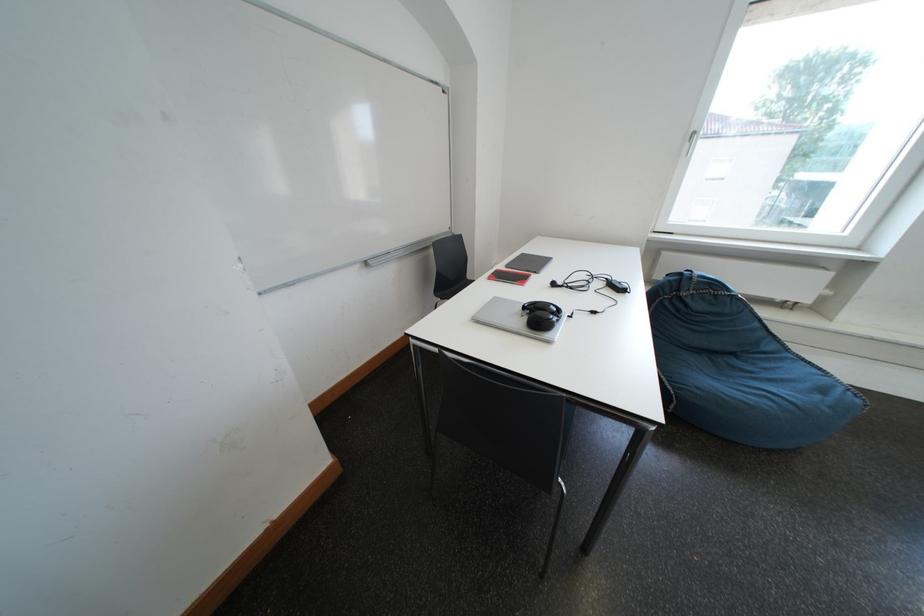
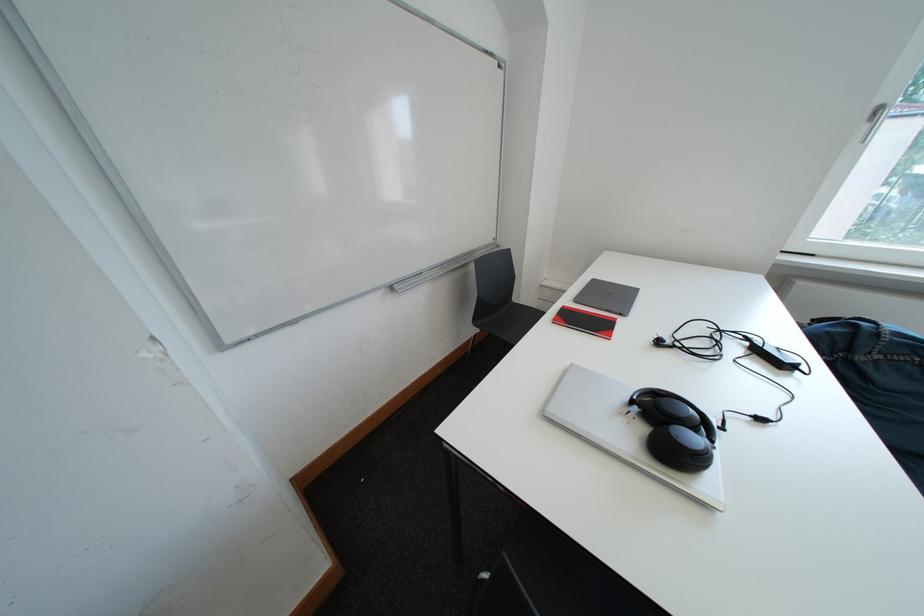
Find the pixel in the second image that matches pixel 536 310 in the first image.

(642, 405)